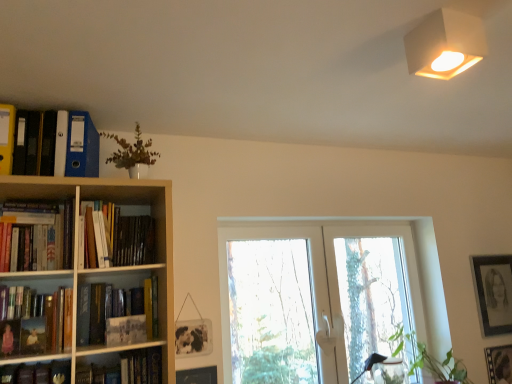
Question: Considering the relative sizes of hardcover book at center-left, positioned as the second book in bottom-to-top order, and white matte lampshade at upper right in the image provided, is hardcover book at center-left, positioned as the second book in bottom-to-top order, taller than white matte lampshade at upper right?

Choices:
 (A) yes
 (B) no

Answer: (A)

Question: Does hardcover book at center-left, placed as the 3th book when sorted from top to bottom, contain white matte lampshade at upper right?

Choices:
 (A) no
 (B) yes

Answer: (A)

Question: Can you confirm if hardcover book at center-left, placed as the 3th book when sorted from top to bottom, is wider than white matte lampshade at upper right?

Choices:
 (A) yes
 (B) no

Answer: (B)

Question: Does hardcover book at center-left, positioned as the second book in bottom-to-top order, appear on the left side of white matte lampshade at upper right?

Choices:
 (A) no
 (B) yes

Answer: (B)

Question: Is hardcover book at center-left, placed as the 3th book when sorted from top to bottom, far from white matte lampshade at upper right?

Choices:
 (A) yes
 (B) no

Answer: (A)

Question: Can you confirm if hardcover book at center-left, positioned as the second book in bottom-to-top order, is positioned to the right of white matte lampshade at upper right?

Choices:
 (A) no
 (B) yes

Answer: (A)

Question: From the image's perspective, is hardcover book at lower left, which is the 4th book in top-to-bottom order, below wooden picture frame at lower center, placed as the 2th picture frame when sorted from top to bottom?

Choices:
 (A) no
 (B) yes

Answer: (A)

Question: Considering the relative positions of hardcover book at lower left, the first book from the bottom, and wooden picture frame at lower center, acting as the 3th picture frame starting from the right, in the image provided, is hardcover book at lower left, the first book from the bottom, to the right of wooden picture frame at lower center, acting as the 3th picture frame starting from the right, from the viewer's perspective?

Choices:
 (A) yes
 (B) no

Answer: (B)

Question: Considering the relative sizes of hardcover book at lower left, the first book from the bottom, and wooden picture frame at lower center, acting as the third picture frame starting from the back, in the image provided, is hardcover book at lower left, the first book from the bottom, wider than wooden picture frame at lower center, acting as the third picture frame starting from the back,?

Choices:
 (A) yes
 (B) no

Answer: (A)

Question: Is hardcover book at lower left, the first book from the bottom, located outside wooden picture frame at lower center, acting as the third picture frame starting from the back?

Choices:
 (A) yes
 (B) no

Answer: (A)

Question: Considering the relative sizes of hardcover book at lower left, the first book from the bottom, and wooden picture frame at lower center, which is counted as the first picture frame, starting from the front, in the image provided, is hardcover book at lower left, the first book from the bottom, bigger than wooden picture frame at lower center, which is counted as the first picture frame, starting from the front,?

Choices:
 (A) no
 (B) yes

Answer: (B)

Question: Are hardcover book at lower left, the first book from the bottom, and wooden picture frame at lower center, acting as the third picture frame starting from the back, far apart?

Choices:
 (A) yes
 (B) no

Answer: (B)

Question: Can you confirm if white matte lampshade at upper right is smaller than hardcover book at lower left, which is the 4th book in top-to-bottom order?

Choices:
 (A) yes
 (B) no

Answer: (A)